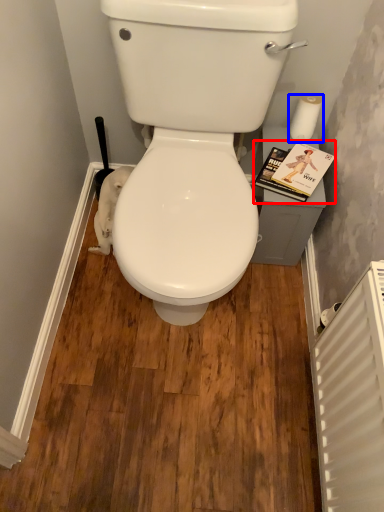
Question: Which of the following is the closest to the observer, paperback book (highlighted by a red box) or toilet paper (highlighted by a blue box)?

Choices:
 (A) paperback book
 (B) toilet paper

Answer: (A)